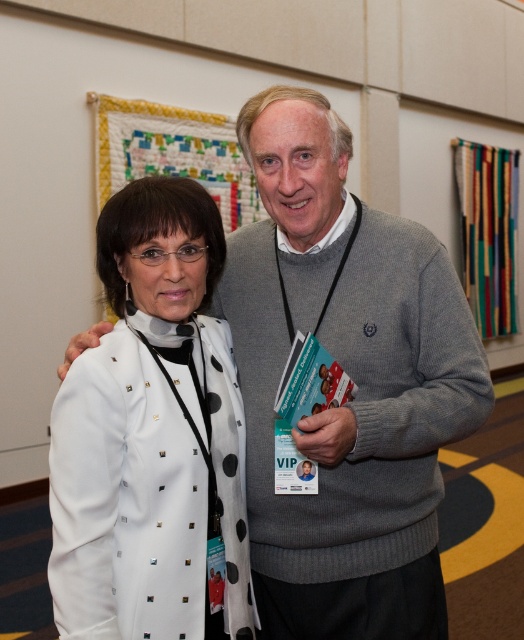
Question: Considering the real-world distances, which object is closest to the white textured coat at center?

Choices:
 (A) white studded coat at left
 (B) teal paper booklet at center

Answer: (B)

Question: Which of the following is the closest to the observer?

Choices:
 (A) teal paper booklet at center
 (B) white studded coat at left

Answer: (B)

Question: Is white textured coat at center smaller than white studded coat at left?

Choices:
 (A) yes
 (B) no

Answer: (B)

Question: Which of the following is the farthest from the observer?

Choices:
 (A) teal paper booklet at center
 (B) white studded coat at left

Answer: (A)

Question: Does white textured coat at center have a larger size compared to teal paper booklet at center?

Choices:
 (A) no
 (B) yes

Answer: (B)

Question: Can you confirm if white textured coat at center is positioned below white studded coat at left?

Choices:
 (A) yes
 (B) no

Answer: (B)